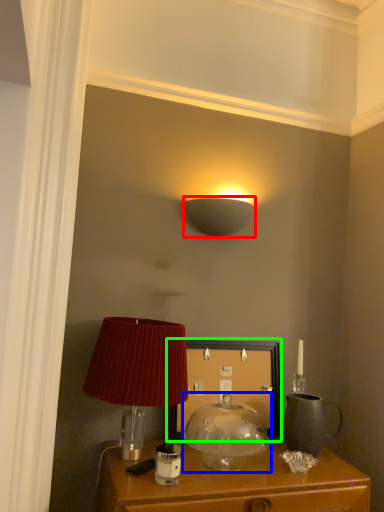
Question: Considering the real-world distances, which object is farthest from lamp (highlighted by a red box)? lamp (highlighted by a blue box) or picture frame (highlighted by a green box)?

Choices:
 (A) lamp
 (B) picture frame

Answer: (A)